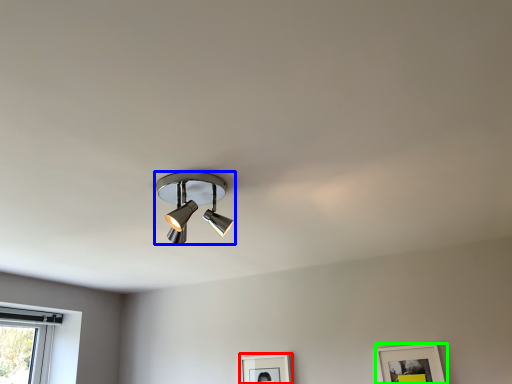
Question: Based on their relative distances, which object is nearer to picture frame (highlighted by a red box)? Choose from lamp (highlighted by a blue box) and picture frame (highlighted by a green box).

Choices:
 (A) lamp
 (B) picture frame

Answer: (B)